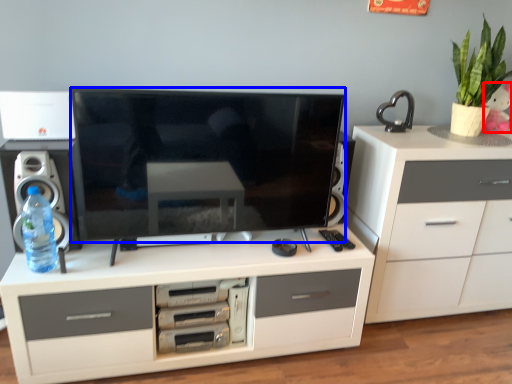
Question: Which object appears farthest to the camera in this image, toy (highlighted by a red box) or television (highlighted by a blue box)?

Choices:
 (A) toy
 (B) television

Answer: (A)